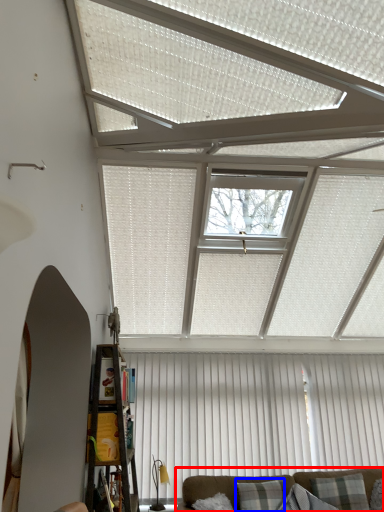
Question: Which object is closer to the camera taking this photo, studio couch (highlighted by a red box) or pillow (highlighted by a blue box)?

Choices:
 (A) studio couch
 (B) pillow

Answer: (A)